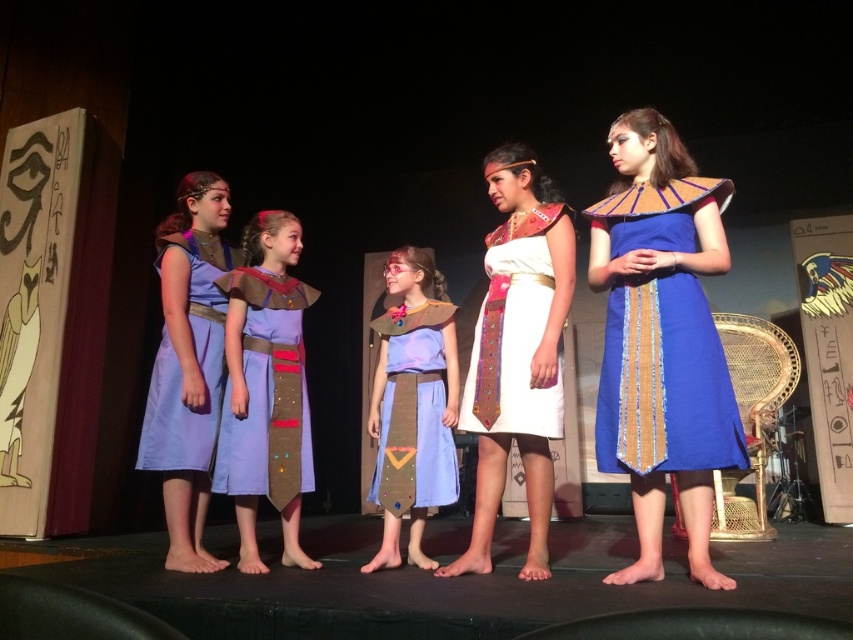
You are a stagehand adjusting the lighting for a play. You notice two dresses on stage, the white cotton dress at center and the lavender satin dress at center. Which dress should you adjust the spotlight to highlight first if you want to focus on the taller one?

The white cotton dress at center is much taller than the lavender satin dress at center, so you should adjust the spotlight to highlight the white cotton dress at center first.

Based on the scene description, which of the two dresses, the blue woven dress at right or the light blue fabric dress at center, is taller?

The blue woven dress at right is taller than the light blue fabric dress at center according to the description.